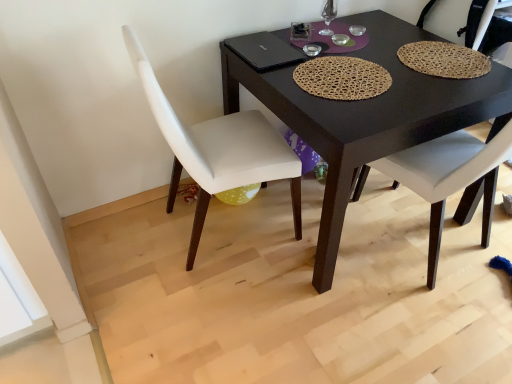
Question: Is black matte table at center smaller than white leather chair at center, which ranks as the second chair in left-to-right order?

Choices:
 (A) yes
 (B) no

Answer: (B)

Question: Can you confirm if black matte table at center is bigger than white leather chair at center, which ranks as the second chair in left-to-right order?

Choices:
 (A) yes
 (B) no

Answer: (A)

Question: Is black matte table at center to the right of white leather chair at center, the 1th chair from the right, from the viewer's perspective?

Choices:
 (A) yes
 (B) no

Answer: (B)

Question: Is black matte table at center in contact with white leather chair at center, which ranks as the second chair in left-to-right order?

Choices:
 (A) yes
 (B) no

Answer: (B)

Question: From a real-world perspective, is black matte table at center positioned over white leather chair at center, the 1th chair from the right, based on gravity?

Choices:
 (A) yes
 (B) no

Answer: (B)

Question: From a real-world perspective, is white leather chair at center, the 1th chair from the right, positioned above or below black matte table at center?

Choices:
 (A) above
 (B) below

Answer: (A)

Question: From their relative heights in the image, would you say white leather chair at center, the 1th chair from the right, is taller or shorter than black matte table at center?

Choices:
 (A) short
 (B) tall

Answer: (B)

Question: Considering their positions, is white leather chair at center, the 1th chair from the right, located in front of or behind black matte table at center?

Choices:
 (A) front
 (B) behind

Answer: (B)

Question: In the image, is white leather chair at center, which ranks as the second chair in left-to-right order, on the left side or the right side of black matte table at center?

Choices:
 (A) right
 (B) left

Answer: (A)

Question: Is white leather chair at center, the 1th chair from the right, situated inside white leather chair at lower left, the 2th chair when ordered from right to left, or outside?

Choices:
 (A) inside
 (B) outside

Answer: (B)

Question: Considering the positions of white leather chair at center, the 1th chair from the right, and white leather chair at lower left, the 1th chair positioned from the left, in the image, is white leather chair at center, the 1th chair from the right, taller or shorter than white leather chair at lower left, the 1th chair positioned from the left,?

Choices:
 (A) short
 (B) tall

Answer: (A)

Question: Is white leather chair at center, which ranks as the second chair in left-to-right order, to the left or to the right of white leather chair at lower left, the 1th chair positioned from the left, in the image?

Choices:
 (A) left
 (B) right

Answer: (B)

Question: Does point (430, 3) appear closer or farther from the camera than point (166, 203)?

Choices:
 (A) closer
 (B) farther

Answer: (A)

Question: Looking at the image, does black matte table at center seem bigger or smaller compared to white leather chair at center, the 1th chair from the right?

Choices:
 (A) small
 (B) big

Answer: (B)

Question: From the image's perspective, is black matte table at center located above or below white leather chair at center, the 1th chair from the right?

Choices:
 (A) above
 (B) below

Answer: (B)